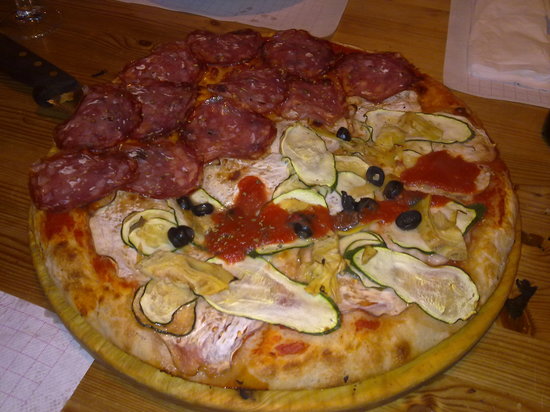
Where is `paper mat top right`? This screenshot has height=412, width=550. paper mat top right is located at coordinates (508, 50).